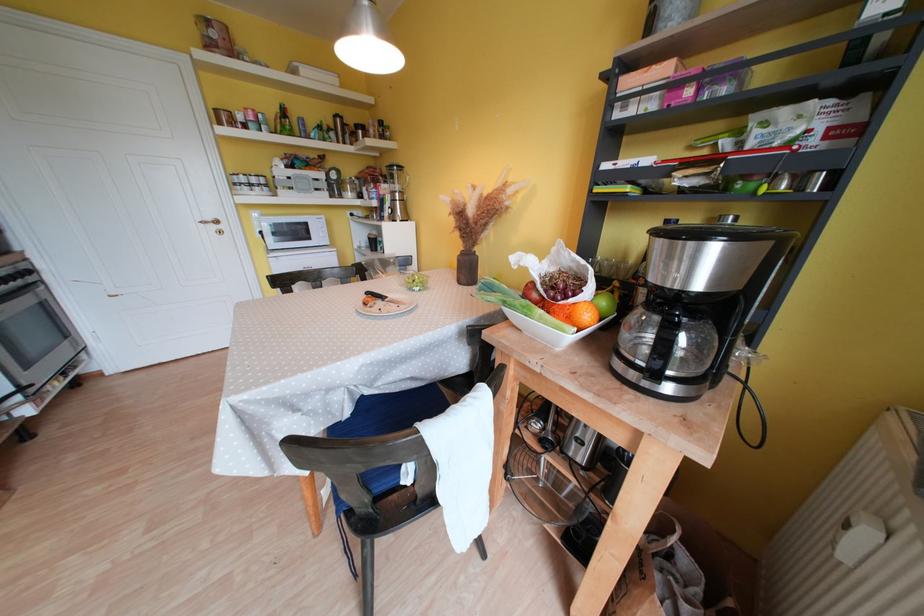
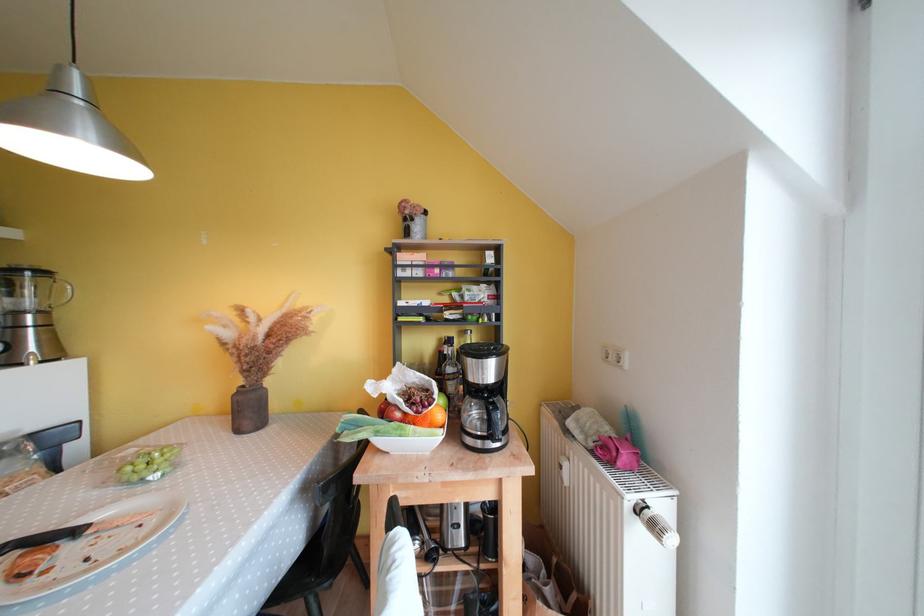
Where in the second image is the point corresponding to (x=573, y=300) from the first image?

(431, 411)